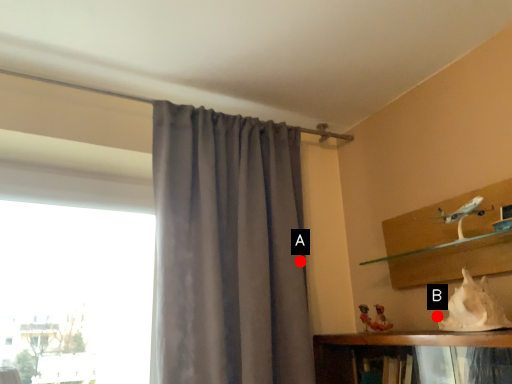
Question: Two points are circled on the image, labeled by A and B beside each circle. Among these points, which one is farthest from the camera?

Choices:
 (A) A is further
 (B) B is further

Answer: (A)